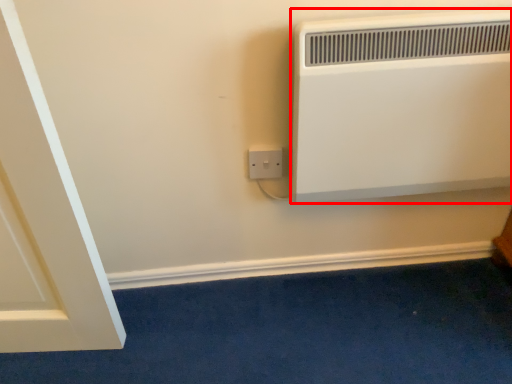
Question: Considering the relative positions of heater (annotated by the red box) and power plugs and sockets in the image provided, where is heater (annotated by the red box) located with respect to the staircase?

Choices:
 (A) left
 (B) right

Answer: (B)